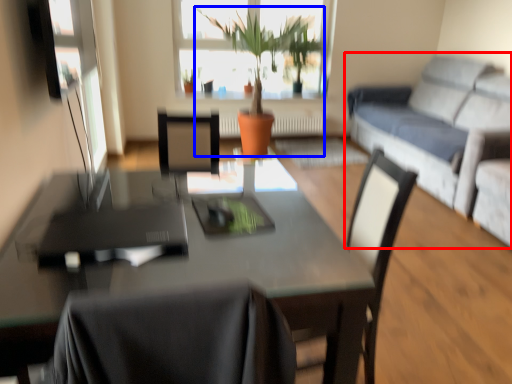
Question: Which object appears closest to the camera in this image, studio couch (highlighted by a red box) or houseplant (highlighted by a blue box)?

Choices:
 (A) studio couch
 (B) houseplant

Answer: (A)